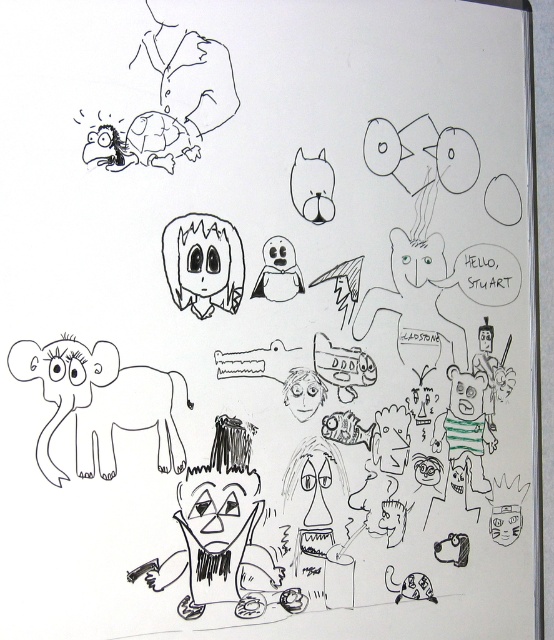
Between point (140, 374) and point (296, 176), which one is positioned behind?

Point (296, 176)

Which is in front, point (66, 340) or point (320, 164)?

Point (66, 340) is more forward.

The height and width of the screenshot is (640, 554). In order to click on matte black elephant at lower left in this screenshot , I will do `click(99, 403)`.

How much distance is there between matte black elephant at lower left and black line art face at center?

They are 5.39 inches apart.

Does point (80, 365) come closer to viewer compared to point (192, 310)?

Yes, it is.

Identify the location of matte black elephant at lower left. (99, 403).

Who is positioned more to the left, black line art face at center or matte black cat at center?

black line art face at center is more to the left.

Describe the element at coordinates (202, 262) in the screenshot. I see `black line art face at center` at that location.

Where is `black line art face at center`? The width and height of the screenshot is (554, 640). black line art face at center is located at coordinates (202, 262).